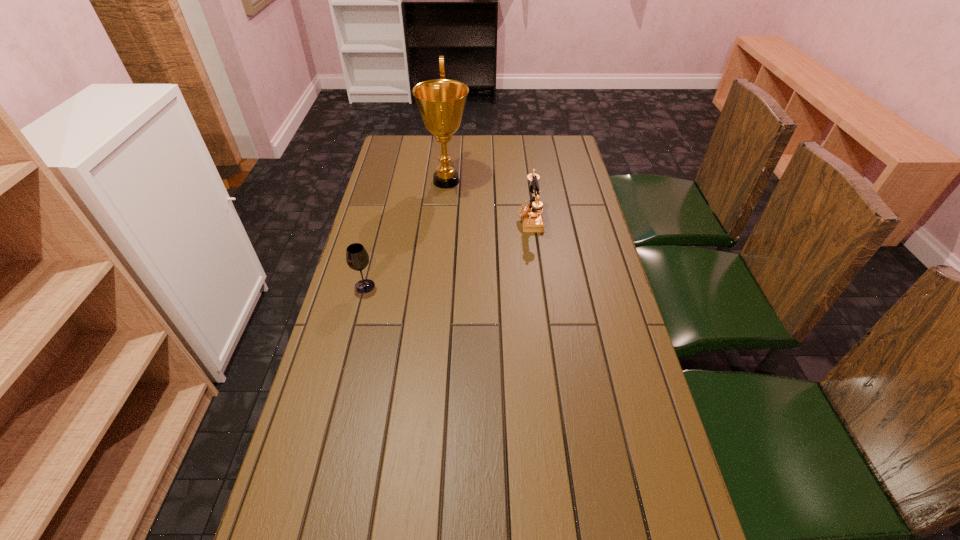
The image size is (960, 540). What are the coordinates of `blank area located on the back of the leftmost object` in the screenshot? It's located at (373, 252).

Locate an element on the screen. This screenshot has height=540, width=960. object situated at the far edge is located at coordinates (441, 102).

You are a GUI agent. You are given a task and a screenshot of the screen. Output one action in this format:
    pyautogui.click(x=<x>, y=<y>)
    Task: Click on the object that is at the left edge
    Image resolution: width=960 pixels, height=540 pixels.
    Given the screenshot: What is the action you would take?
    pyautogui.click(x=357, y=258)

Locate an element on the screen. This screenshot has height=540, width=960. vacant area at the far edge of the desktop is located at coordinates (432, 147).

In the image, there is a desktop. Where is `vacant space at the left edge`? vacant space at the left edge is located at coordinates (360, 242).

Find the location of `free space at the right edge of the desktop`. free space at the right edge of the desktop is located at coordinates (621, 453).

I want to click on free space at the far right corner of the desktop, so click(x=557, y=158).

Find the location of a particular element. This screenshot has height=540, width=960. empty space that is in between the nearest object and the telephone is located at coordinates (447, 253).

Locate an element on the screen. free point between the rightmost object and the tallest object is located at coordinates (488, 200).

This screenshot has width=960, height=540. Find the location of `empty space that is in between the leftmost object and the farthest object`. empty space that is in between the leftmost object and the farthest object is located at coordinates (405, 234).